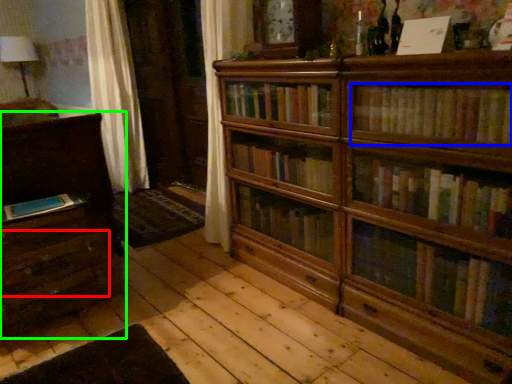
Question: Which object is the farthest from drawer (highlighted by a red box)? Choose among these: book (highlighted by a blue box) or chest of drawers (highlighted by a green box).

Choices:
 (A) book
 (B) chest of drawers

Answer: (A)